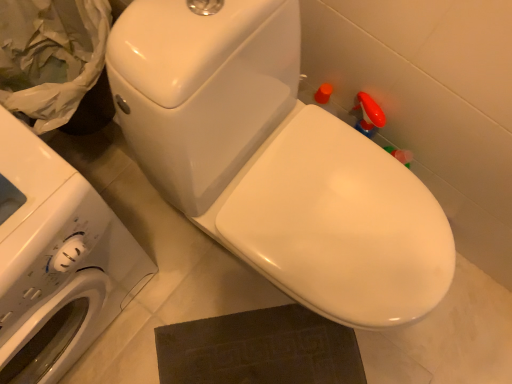
From the picture: Measure the distance between point (117, 269) and camera.

A distance of 31.65 inches exists between point (117, 269) and camera.

Locate an element on the screen. This screenshot has width=512, height=384. white glossy washing machine at left is located at coordinates (56, 260).

What is the approximate height of white glossy washing machine at left?

white glossy washing machine at left is 27.42 inches in height.

The image size is (512, 384). What do you see at coordinates (56, 260) in the screenshot?
I see `white glossy washing machine at left` at bounding box center [56, 260].

This screenshot has height=384, width=512. Describe the element at coordinates (274, 162) in the screenshot. I see `white glossy toilet at center` at that location.

Image resolution: width=512 pixels, height=384 pixels. I want to click on white glossy toilet at center, so click(274, 162).

I want to click on white glossy washing machine at left, so click(56, 260).

Considering the positions of objects white glossy toilet at center and white glossy washing machine at left in the image provided, who is more to the left, white glossy toilet at center or white glossy washing machine at left?

From the viewer's perspective, white glossy washing machine at left appears more on the left side.

Based on the photo, is white glossy toilet at center positioned before white glossy washing machine at left?

No, white glossy toilet at center is further to the viewer.

Which is in front, point (175, 84) or point (64, 174)?

Point (64, 174)

From the image's perspective, relative to white glossy washing machine at left, is white glossy toilet at center above or below?

Based on their image positions, white glossy toilet at center is located above white glossy washing machine at left.

From a real-world perspective, is white glossy toilet at center positioned over white glossy washing machine at left based on gravity?

Yes, from a real-world perspective, white glossy toilet at center is on top of white glossy washing machine at left.

Which of these two, white glossy toilet at center or white glossy washing machine at left, is thinner?

white glossy washing machine at left is thinner.

Does white glossy toilet at center have a greater height compared to white glossy washing machine at left?

Incorrect, the height of white glossy toilet at center is not larger of that of white glossy washing machine at left.

Is white glossy toilet at center bigger than white glossy washing machine at left?

No, white glossy toilet at center is not bigger than white glossy washing machine at left.

Looking at this image, is white glossy toilet at center outside of white glossy washing machine at left?

Indeed, white glossy toilet at center is completely outside white glossy washing machine at left.

Are white glossy toilet at center and white glossy washing machine at left beside each other?

No, white glossy toilet at center is not next to white glossy washing machine at left.

Is white glossy toilet at center oriented away from white glossy washing machine at left?

white glossy toilet at center is not turned away from white glossy washing machine at left.

How distant is white glossy toilet at center from white glossy washing machine at left?

11.12 inches.

The image size is (512, 384). Find the location of `washing machine located in front of the white glossy toilet at center`. washing machine located in front of the white glossy toilet at center is located at coordinates (56, 260).

Considering the relative positions of white glossy washing machine at left and white glossy toilet at center in the image provided, is white glossy washing machine at left to the left of white glossy toilet at center from the viewer's perspective?

Yes.

Based on the photo, which object is further away from the camera, white glossy washing machine at left or white glossy toilet at center?

white glossy toilet at center.

Which point is more forward, (x=97, y=313) or (x=185, y=102)?

The point (x=185, y=102) is in front.

From the image's perspective, is white glossy washing machine at left above or below white glossy toilet at center?

white glossy washing machine at left is below white glossy toilet at center.

Consider the image. From a real-world perspective, is white glossy washing machine at left positioned above or below white glossy toilet at center?

From a real-world perspective, white glossy washing machine at left is physically below white glossy toilet at center.

Can you confirm if white glossy washing machine at left is wider than white glossy toilet at center?

No.

Which of these two, white glossy washing machine at left or white glossy toilet at center, stands shorter?

white glossy toilet at center.

Which of these two, white glossy washing machine at left or white glossy toilet at center, is bigger?

Bigger between the two is white glossy washing machine at left.

Is white glossy washing machine at left inside or outside of white glossy toilet at center?

white glossy washing machine at left exists outside the volume of white glossy toilet at center.

Would you consider white glossy washing machine at left to be distant from white glossy toilet at center?

No.

Could you tell me if white glossy washing machine at left is turned towards white glossy toilet at center?

No, white glossy washing machine at left is not aimed at white glossy toilet at center.

Can you tell me how much white glossy washing machine at left and white glossy toilet at center differ in facing direction?

0.000262 degrees separate the facing orientations of white glossy washing machine at left and white glossy toilet at center.

How far apart are white glossy washing machine at left and white glossy toilet at center?

white glossy washing machine at left and white glossy toilet at center are 11.12 inches apart.

In the image, there is a white glossy washing machine at left. Identify the location of toilet above it (from the image's perspective). (274, 162).

Identify the location of washing machine lying below the white glossy toilet at center (from the image's perspective). The width and height of the screenshot is (512, 384). (56, 260).

Locate an element on the screen. The height and width of the screenshot is (384, 512). toilet above the white glossy washing machine at left (from the image's perspective) is located at coordinates (274, 162).